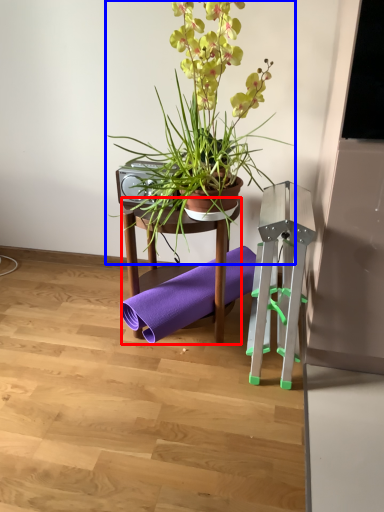
Question: Among these objects, which one is nearest to the camera, furniture (highlighted by a red box) or houseplant (highlighted by a blue box)?

Choices:
 (A) furniture
 (B) houseplant

Answer: (B)